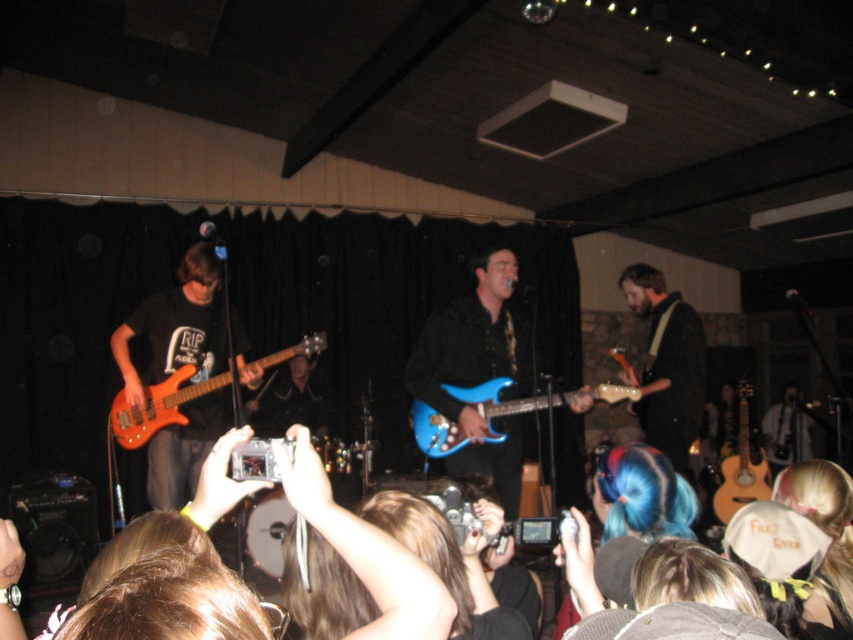
Question: Estimate the real-world distances between objects in this image. Which object is farther from the matte orange bass guitar at left?

Choices:
 (A) shiny brown guitar at center
 (B) blue glossy electric guitar at center
 (C) acoustic wood guitar at right

Answer: (C)

Question: Does blue glossy electric guitar at center have a greater width compared to matte orange bass guitar at left?

Choices:
 (A) yes
 (B) no

Answer: (A)

Question: Which object appears closest to the camera in this image?

Choices:
 (A) blue glossy electric guitar at center
 (B) matte orange bass guitar at left
 (C) shiny brown guitar at center

Answer: (A)

Question: Does shiny brown guitar at center appear on the left side of acoustic wood guitar at right?

Choices:
 (A) no
 (B) yes

Answer: (B)

Question: Can you confirm if shiny brown guitar at center is positioned to the right of blue glossy electric guitar at center?

Choices:
 (A) no
 (B) yes

Answer: (B)

Question: Which object appears closest to the camera in this image?

Choices:
 (A) shiny brown guitar at center
 (B) matte orange bass guitar at left

Answer: (B)